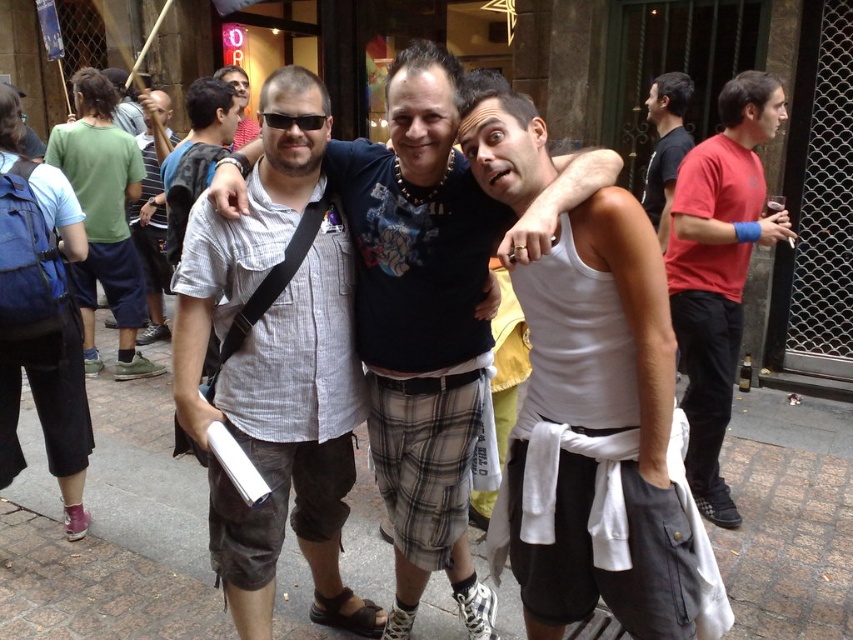
Question: Is red cotton t-shirt at right wider than matte black sunglasses at upper center?

Choices:
 (A) yes
 (B) no

Answer: (B)

Question: Which point is farther to the camera?

Choices:
 (A) (436, 472)
 (B) (129, 328)
 (C) (219, 298)
 (D) (41, 387)

Answer: (B)

Question: Is brown brick pavement at center further to camera compared to red cotton t-shirt at right?

Choices:
 (A) yes
 (B) no

Answer: (B)

Question: Which point is closer to the camera?

Choices:
 (A) (648, 161)
 (B) (271, 230)
 (C) (68, 522)

Answer: (B)

Question: Does matte black shirt at center lie in front of brown brick pavement at center?

Choices:
 (A) no
 (B) yes

Answer: (B)

Question: Which of the following is the closest to the observer?

Choices:
 (A) (726, 602)
 (B) (433, 264)

Answer: (A)